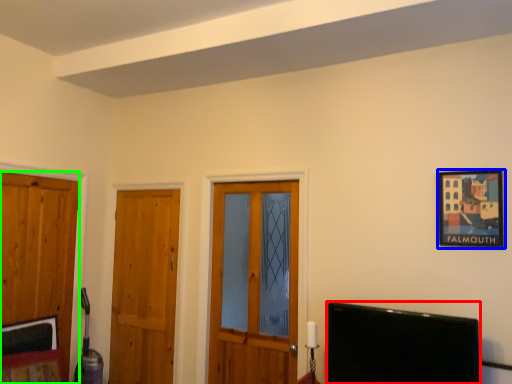
Question: Which object is positioned farthest from television (highlighted by a red box)? Select from picture frame (highlighted by a blue box) and door (highlighted by a green box).

Choices:
 (A) picture frame
 (B) door

Answer: (B)